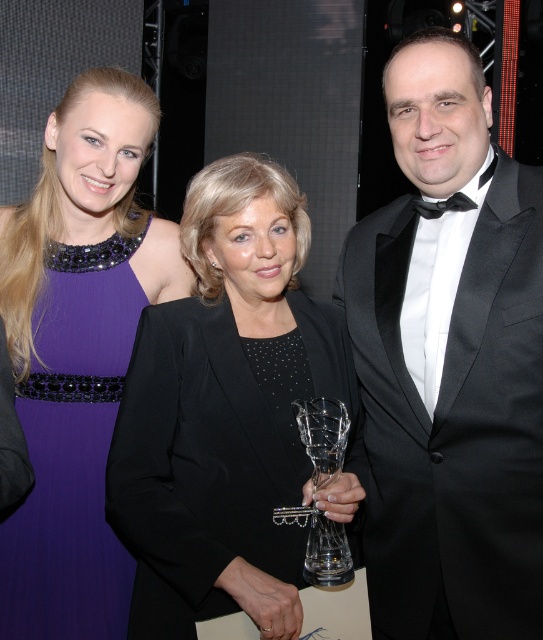
Question: Which point is closer to the camera taking this photo?

Choices:
 (A) (310, 561)
 (B) (279, 404)
 (C) (428, 177)
 (D) (87, 304)

Answer: (A)

Question: Is black satin blazer at center smaller than purple satin dress at upper left?

Choices:
 (A) yes
 (B) no

Answer: (B)

Question: Estimate the real-world distances between objects in this image. Which object is farther from the black satin blazer at center?

Choices:
 (A) purple satin dress at upper left
 (B) black satin tuxedo at right
 (C) clear glass trophy at center

Answer: (A)

Question: Which object is farther from the camera taking this photo?

Choices:
 (A) black satin blazer at center
 (B) black satin tuxedo at right

Answer: (B)

Question: Is black satin blazer at center further to the viewer compared to clear glass trophy at center?

Choices:
 (A) yes
 (B) no

Answer: (B)

Question: Does black satin blazer at center have a smaller size compared to purple satin dress at upper left?

Choices:
 (A) yes
 (B) no

Answer: (B)